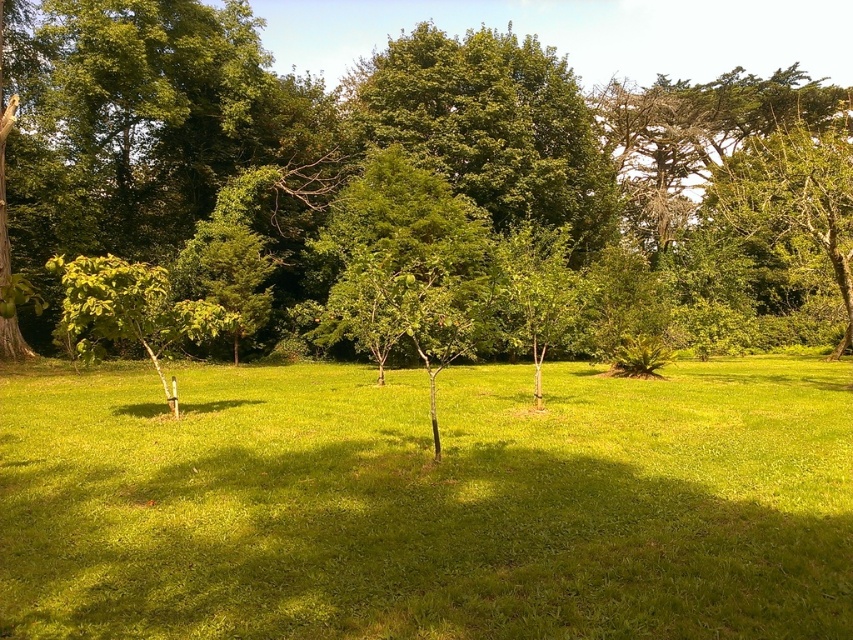
You are a gardener who wants to plant a new flower bed between the green grass at center and the green leafy tree at center. Which area should you choose to ensure the flower bed has enough space to grow properly?

The green leafy tree at center has a greater width than the green grass at center, so the flower bed should be placed near the green leafy tree at center to ensure there is enough space for growth.

You are a gardener who wants to plant a new flower bed between the green grass at center and the green leafy tree at left. Based on their positions, where should you place the flower bed?

The green grass at center is positioned under the green leafy tree at left, so the flower bed should be placed between them, ensuring it is not directly under the tree to avoid root competition.